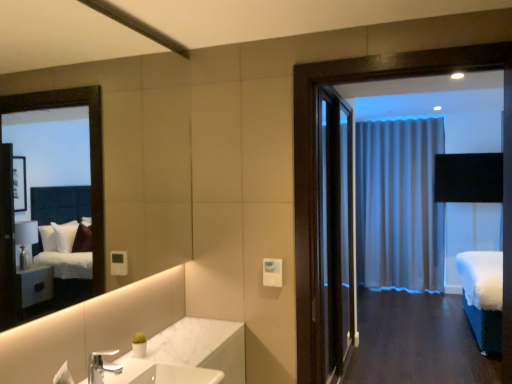
Locate an element on the screen. white marble sink at lower center is located at coordinates (159, 373).

Describe the element at coordinates (399, 205) in the screenshot. I see `silky gray curtain at center` at that location.

The image size is (512, 384). Identify the location of dark wood door at center. (335, 230).

At what (x,y) coordinates should I click in order to perform the action: click on white marble sink at lower center. Please return your answer as a coordinate pair (x, y). This screenshot has height=384, width=512. Looking at the image, I should click on (159, 373).

Would you consider silver metallic faucet at lower left to be distant from dark wood door at center?

That's right, there is a large distance between silver metallic faucet at lower left and dark wood door at center.

Where is `door above the silver metallic faucet at lower left (from the image's perspective)`? Image resolution: width=512 pixels, height=384 pixels. door above the silver metallic faucet at lower left (from the image's perspective) is located at coordinates (335, 230).

Does point (90, 370) lie behind point (319, 121)?

No.

Is silver metallic faucet at lower left looking in the opposite direction of dark wood door at center?

No, dark wood door at center is not at the back of silver metallic faucet at lower left.

Considering the sizes of white fabric bed at right and silver metallic faucet at lower left in the image, is white fabric bed at right wider or thinner than silver metallic faucet at lower left?

In the image, white fabric bed at right appears to be wider than silver metallic faucet at lower left.

Considering the sizes of objects white fabric bed at right and silver metallic faucet at lower left in the image provided, who is shorter, white fabric bed at right or silver metallic faucet at lower left?

silver metallic faucet at lower left.

Would you say white fabric bed at right is inside or outside silver metallic faucet at lower left?

white fabric bed at right cannot be found inside silver metallic faucet at lower left.

Does white fabric bed at right come in front of silver metallic faucet at lower left?

No, white fabric bed at right is behind silver metallic faucet at lower left.

Is white marble sink at lower center oriented away from silver metallic faucet at lower left?

No, white marble sink at lower center is not facing away from silver metallic faucet at lower left.

From the picture: Considering the relative sizes of white marble sink at lower center and silver metallic faucet at lower left in the image provided, is white marble sink at lower center thinner than silver metallic faucet at lower left?

In fact, white marble sink at lower center might be wider than silver metallic faucet at lower left.

From the image's perspective, does white marble sink at lower center appear lower than silver metallic faucet at lower left?

Yes.

From a real-world perspective, which object rests below the other?

In real-world perspective, white marble sink at lower center is lower.

Does white fabric bed at right turn towards dark wood door at center?

No, white fabric bed at right is not turned towards dark wood door at center.

Identify the location of door lying above the white fabric bed at right (from the image's perspective). (335, 230).

Consider the image. From the image's perspective, which one is positioned lower, white fabric bed at right or dark wood door at center?

white fabric bed at right is shown below in the image.

Considering the points (484, 266) and (341, 323), which point is in front, point (484, 266) or point (341, 323)?

Point (484, 266)

Can you confirm if silky gray curtain at center is positioned to the left of dark wood door at center?

No.

In the image, is silky gray curtain at center positioned in front of or behind dark wood door at center?

Clearly, silky gray curtain at center is behind dark wood door at center.

Are silky gray curtain at center and dark wood door at center beside each other?

silky gray curtain at center and dark wood door at center are clearly separated.

Looking at this image, does silky gray curtain at center turn towards dark wood door at center?

Yes, silky gray curtain at center is facing dark wood door at center.

Does white fabric bed at right appear on the left side of silky gray curtain at center?

Incorrect, white fabric bed at right is not on the left side of silky gray curtain at center.

Which is in front, point (482, 253) or point (411, 220)?

The point (482, 253) is closer.

Is white fabric bed at right next to silky gray curtain at center?

No, white fabric bed at right is not making contact with silky gray curtain at center.

Looking at this image, which object is more forward, white fabric bed at right or silky gray curtain at center?

Positioned in front is white fabric bed at right.

Looking at this image, from the image's perspective, relative to dark wood door at center, is white marble sink at lower center above or below?

Based on their image positions, white marble sink at lower center is located beneath dark wood door at center.

Considering the relative positions of white marble sink at lower center and dark wood door at center in the image provided, is white marble sink at lower center to the right of dark wood door at center from the viewer's perspective?

Incorrect, white marble sink at lower center is not on the right side of dark wood door at center.

Identify the location of sink below the dark wood door at center (from the image's perspective). The image size is (512, 384). (159, 373).

Is white marble sink at lower center taller than dark wood door at center?

In fact, white marble sink at lower center may be shorter than dark wood door at center.

Image resolution: width=512 pixels, height=384 pixels. In order to click on door above the silver metallic faucet at lower left (from a real-world perspective) in this screenshot , I will do `click(335, 230)`.

Identify the location of bed below the silver metallic faucet at lower left (from a real-world perspective). coord(483,296).

Considering their positions, is silver metallic faucet at lower left positioned further to silky gray curtain at center than dark wood door at center?

silver metallic faucet at lower left is further to silky gray curtain at center.

Estimate the real-world distances between objects in this image. Which object is further from white marble sink at lower center, silky gray curtain at center or dark wood door at center?

silky gray curtain at center is positioned further to the anchor white marble sink at lower center.

When comparing their distances from silver metallic faucet at lower left, does silky gray curtain at center or white marble sink at lower center seem further?

Among the two, silky gray curtain at center is located further to silver metallic faucet at lower left.

Considering their positions, is white marble sink at lower center positioned further to dark wood door at center than silky gray curtain at center?

Among the two, white marble sink at lower center is located further to dark wood door at center.

Estimate the real-world distances between objects in this image. Which object is further from white marble sink at lower center, dark wood door at center or silver metallic faucet at lower left?

Based on the image, dark wood door at center appears to be further to white marble sink at lower center.

Considering their positions, is silky gray curtain at center positioned closer to white marble sink at lower center than silver metallic faucet at lower left?

silver metallic faucet at lower left is positioned closer to the anchor white marble sink at lower center.

Based on the photo, based on their spatial positions, is white marble sink at lower center or dark wood door at center closer to silky gray curtain at center?

dark wood door at center.

From the image, which object appears to be farther from silver metallic faucet at lower left, white fabric bed at right or dark wood door at center?

dark wood door at center is further to silver metallic faucet at lower left.

You are a GUI agent. You are given a task and a screenshot of the screen. Output one action in this format:
    pyautogui.click(x=<x>, y=<y>)
    Task: Click on the tap positioned between white marble sink at lower center and silky gray curtain at center from near to far
    This screenshot has width=512, height=384.
    Given the screenshot: What is the action you would take?
    pyautogui.click(x=101, y=367)

The width and height of the screenshot is (512, 384). Identify the location of door between silver metallic faucet at lower left and white fabric bed at right in the horizontal direction. (335, 230).

The height and width of the screenshot is (384, 512). In order to click on bed between white marble sink at lower center and silky gray curtain at center in the front-back direction in this screenshot , I will do `click(483, 296)`.

Find the location of `bed located between silver metallic faucet at lower left and silky gray curtain at center in the depth direction`. bed located between silver metallic faucet at lower left and silky gray curtain at center in the depth direction is located at coordinates (483, 296).